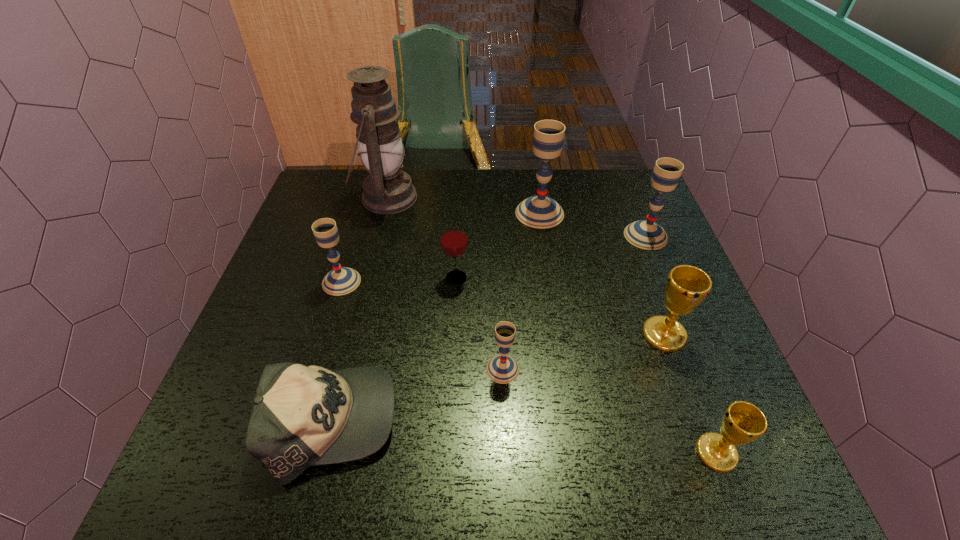
You are a GUI agent. You are given a task and a screenshot of the screen. Output one action in this format:
    pyautogui.click(x=<x>, y=<y>)
    Task: Click on the baseball cap that is at the near edge
    The width and height of the screenshot is (960, 540).
    Given the screenshot: What is the action you would take?
    pyautogui.click(x=302, y=416)

Find the location of `oil lamp positioned at the left edge`. oil lamp positioned at the left edge is located at coordinates (386, 190).

Find the location of a particular element. chalice situated at the left edge is located at coordinates (341, 280).

Where is `baseball cap that is positioned at the left edge`? The width and height of the screenshot is (960, 540). baseball cap that is positioned at the left edge is located at coordinates click(x=302, y=416).

Locate an element on the screen. object that is at the far left corner is located at coordinates (386, 190).

I want to click on object located in the near left corner section of the desktop, so click(302, 416).

This screenshot has height=540, width=960. What are the coordinates of `object at the near right corner` in the screenshot? It's located at (742, 422).

Locate an element on the screen. vacant space at the far edge of the desktop is located at coordinates (451, 192).

Identify the location of blank space at the near edge of the desktop. The image size is (960, 540). click(x=636, y=448).

Where is `vacant space at the left edge`? The height and width of the screenshot is (540, 960). vacant space at the left edge is located at coordinates (282, 293).